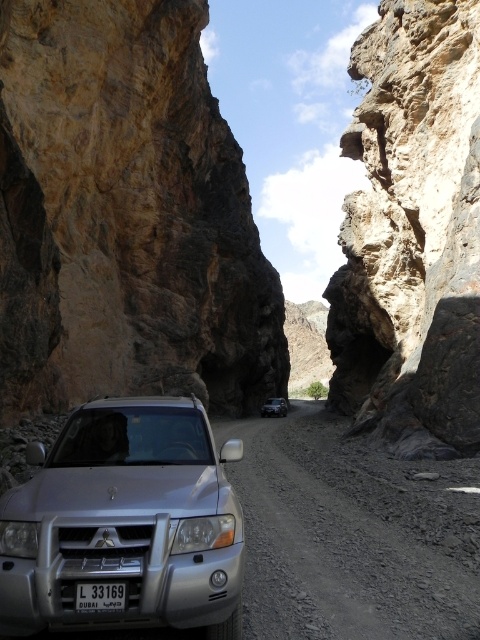
You are a hiker standing at the point marked by the coordinates point (x=124, y=216) in the image. What object is directly beneath your feet?

The rustic brown rock at center is directly beneath your feet at point (x=124, y=216).

You are a hiker planning to drive your car up the narrow dirt road. You see the silver metallic suv at center and the rugged stone mountain at center. Which object is positioned higher in the scene?

The rugged stone mountain at center is positioned higher than the silver metallic suv at center because the suv is located below the mountain.

You are standing at the entrance of the dirt road and want to take a photo of the silver metallic suv at center. Where should you position yourself to capture the vehicle in the frame?

The silver metallic suv at center is located at point (126,522), so you should position yourself at the entrance of the dirt road facing towards that coordinate to capture the vehicle in the frame.